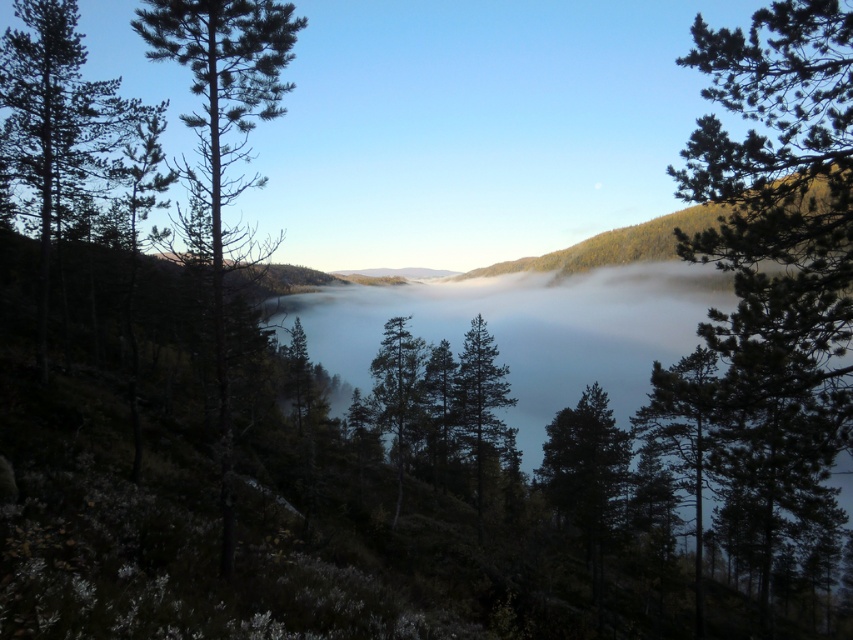
Question: Does green needle-like tree at right appear on the right side of green matte tree at center?

Choices:
 (A) yes
 (B) no

Answer: (A)

Question: Which object is the farthest from the green needle-like tree at left?

Choices:
 (A) green needle-like tree at right
 (B) green matte tree at center

Answer: (B)

Question: Is green needle-like tree at right to the right of green matte tree at center from the viewer's perspective?

Choices:
 (A) no
 (B) yes

Answer: (B)

Question: Which object is the closest to the green matte tree at center?

Choices:
 (A) green needle-like tree at right
 (B) green needle-like tree at left

Answer: (A)

Question: Which point is farther to the camera?

Choices:
 (A) (511, 401)
 (B) (810, 314)

Answer: (A)

Question: Does green needle-like tree at right come in front of green needle-like tree at left?

Choices:
 (A) no
 (B) yes

Answer: (B)